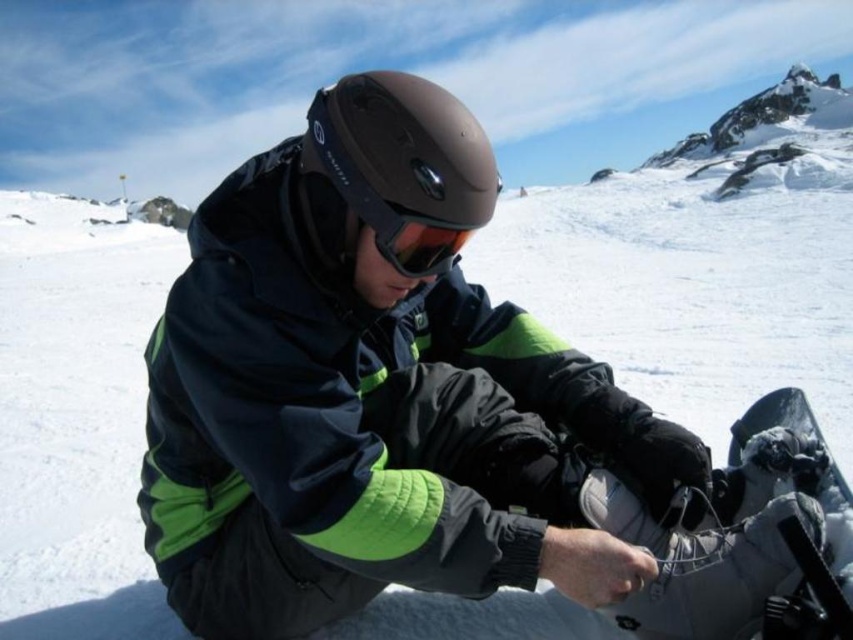
Question: Which of these objects is positioned closest to the matte black helmet at center?

Choices:
 (A) matte brown helmet at center
 (B) white matte snowboard at center

Answer: (A)

Question: Which of these objects is positioned closest to the white matte snowboard at center?

Choices:
 (A) matte brown helmet at center
 (B) matte orange goggles at center
 (C) matte black helmet at center

Answer: (C)

Question: Does matte black helmet at center have a smaller size compared to white matte snowboard at center?

Choices:
 (A) yes
 (B) no

Answer: (B)

Question: Does matte black helmet at center have a smaller size compared to matte orange goggles at center?

Choices:
 (A) no
 (B) yes

Answer: (A)

Question: Among these objects, which one is farthest from the camera?

Choices:
 (A) white matte snowboard at center
 (B) matte brown helmet at center
 (C) matte black helmet at center

Answer: (B)

Question: Is matte black helmet at center to the left of white matte snowboard at center from the viewer's perspective?

Choices:
 (A) yes
 (B) no

Answer: (A)